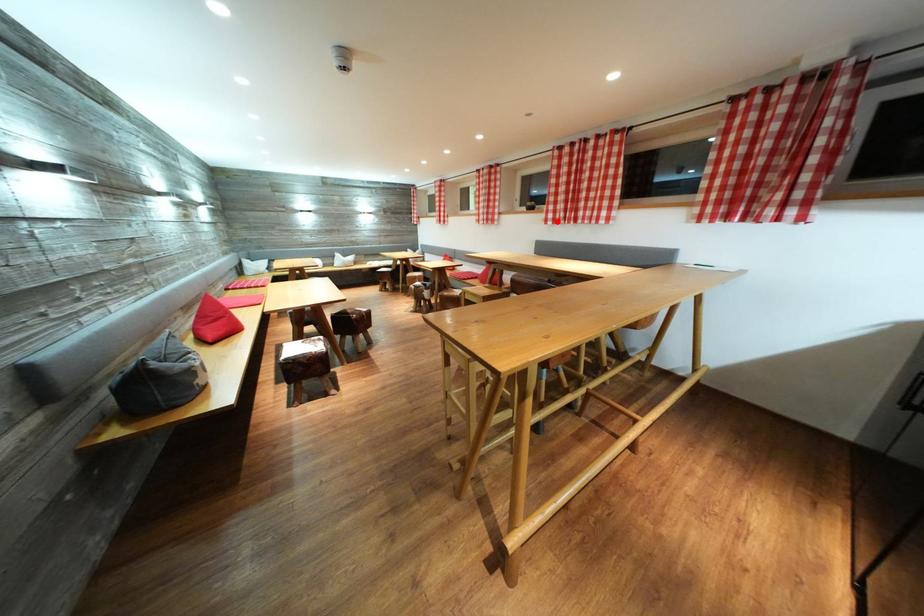
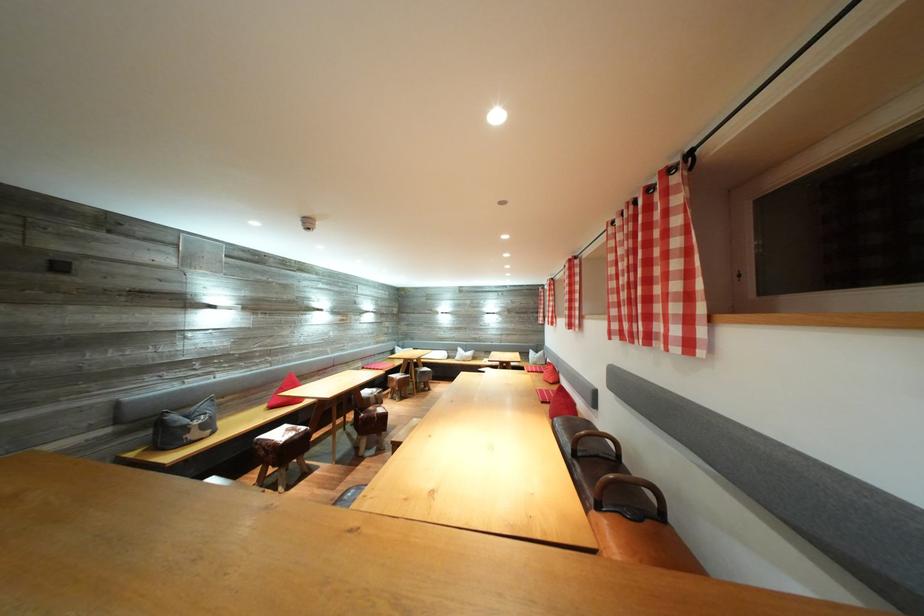
Question: I am providing you with two images of the same scene from different viewpoints. A red point is marked on the first image. Can you still see the location of the red point in image 2?

Choices:
 (A) Yes
 (B) No

Answer: (A)